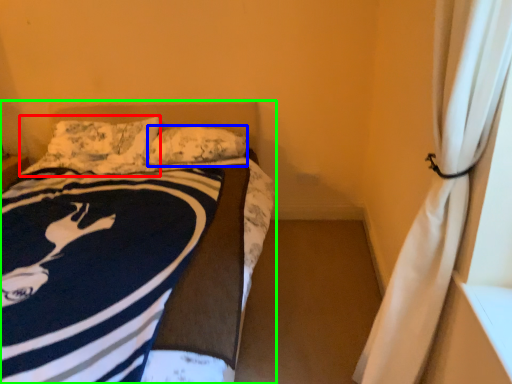
Question: Which is nearer to the pillow (highlighted by a red box)? pillow (highlighted by a blue box) or bed (highlighted by a green box).

Choices:
 (A) pillow
 (B) bed

Answer: (A)